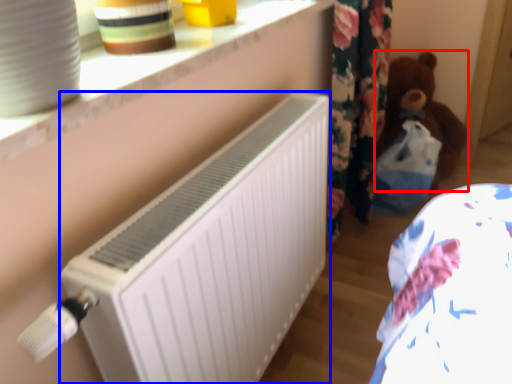
Question: Which point is closer to the camera, teddy (highlighted by a red box) or radiator (highlighted by a blue box)?

Choices:
 (A) teddy
 (B) radiator

Answer: (B)